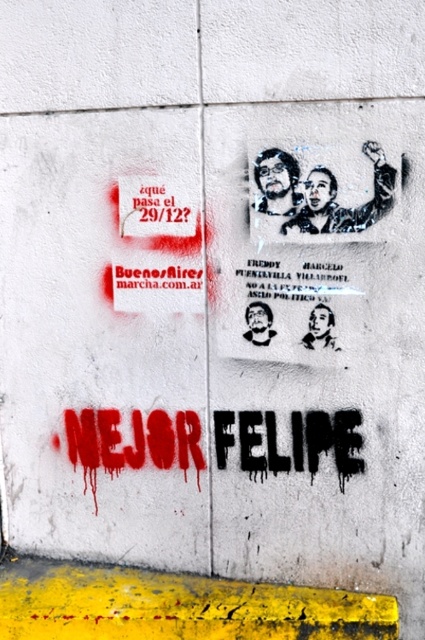
Question: Which of the following is the farthest from the observer?

Choices:
 (A) (105, 625)
 (B) (291, 209)
 (C) (362, 221)
 (D) (280, 262)

Answer: (D)

Question: Does black stencil portrait at upper center appear on the right side of black glossy face at center?

Choices:
 (A) no
 (B) yes

Answer: (B)

Question: Can you confirm if black stencil portrait at upper center is positioned to the left of black glossy portrait at center?

Choices:
 (A) yes
 (B) no

Answer: (B)

Question: Does black stencil portrait at upper center appear over dark hair and beard at upper center?

Choices:
 (A) yes
 (B) no

Answer: (B)

Question: Which object is closer to the camera taking this photo?

Choices:
 (A) black glossy portrait at center
 (B) black glossy face at center

Answer: (A)

Question: Which object appears closest to the camera in this image?

Choices:
 (A) black glossy face at center
 (B) yellow painted curb at lower center
 (C) black stencil portrait at upper center
 (D) black stencil text at upper center

Answer: (C)